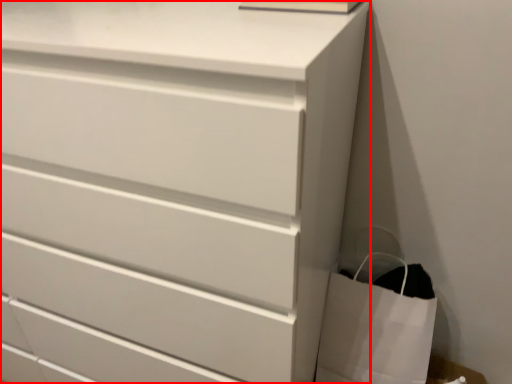
Question: Observing the image, what is the correct spatial positioning of chest of drawers (annotated by the red box) in reference to bag?

Choices:
 (A) left
 (B) right

Answer: (A)